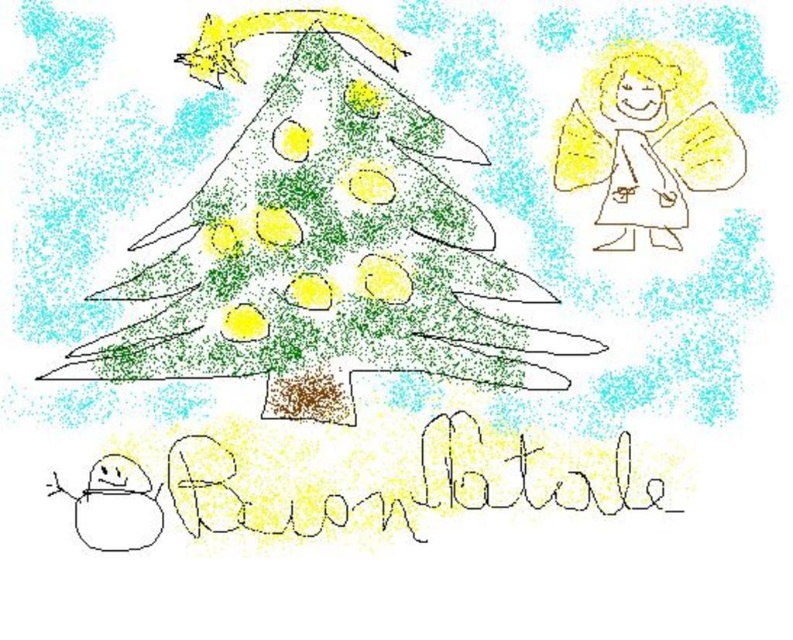
Does green textured christmas tree at center appear on the right side of yellow paper angel at upper right?

In fact, green textured christmas tree at center is to the left of yellow paper angel at upper right.

Can you confirm if green textured christmas tree at center is taller than yellow paper angel at upper right?

Yes, green textured christmas tree at center is taller than yellow paper angel at upper right.

Locate an element on the screen. green textured christmas tree at center is located at coordinates (324, 243).